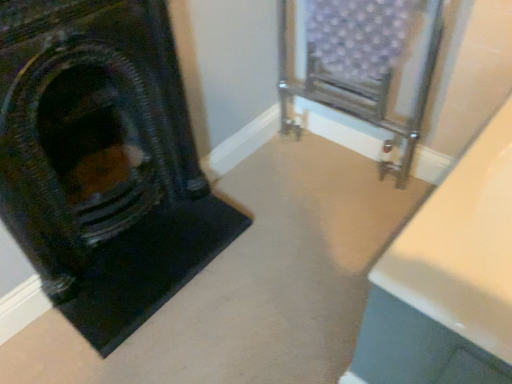
Question: In terms of width, does metallic radiator at center look wider or thinner when compared to matte black fireplace at left?

Choices:
 (A) thin
 (B) wide

Answer: (B)

Question: Is metallic radiator at center to the left or to the right of matte black fireplace at left in the image?

Choices:
 (A) right
 (B) left

Answer: (A)

Question: From the image's perspective, is metallic radiator at center above or below matte black fireplace at left?

Choices:
 (A) below
 (B) above

Answer: (B)

Question: Considering their positions, is matte black fireplace at left located in front of or behind metallic radiator at center?

Choices:
 (A) front
 (B) behind

Answer: (A)

Question: From the image's perspective, relative to metallic radiator at center, is matte black fireplace at left above or below?

Choices:
 (A) below
 (B) above

Answer: (A)

Question: Considering the positions of point (103, 231) and point (355, 67), is point (103, 231) closer or farther from the camera than point (355, 67)?

Choices:
 (A) closer
 (B) farther

Answer: (A)

Question: Which is correct: matte black fireplace at left is inside metallic radiator at center, or outside of it?

Choices:
 (A) inside
 (B) outside

Answer: (B)